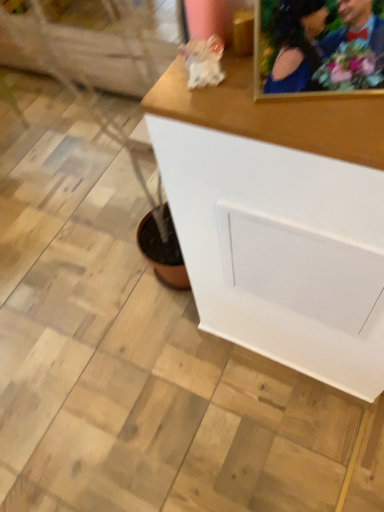
Image resolution: width=384 pixels, height=512 pixels. I want to click on empty space that is ontop of white matte cabinet at center (from a real-world perspective), so click(286, 98).